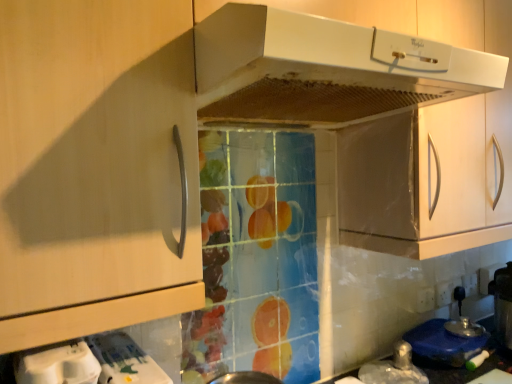
Question: Looking at the image, does white glossy water at lower left, placed as the second appliance when sorted from left to right, seem bigger or smaller compared to white matte range hood at upper center?

Choices:
 (A) small
 (B) big

Answer: (A)

Question: Looking at their shapes, would you say white glossy water at lower left, which is counted as the second appliance, starting from the back, is wider or thinner than white matte range hood at upper center?

Choices:
 (A) wide
 (B) thin

Answer: (B)

Question: Which is farther from the white matte range hood at upper center?

Choices:
 (A) blue plastic lid at lower right, marked as the third appliance in a left-to-right arrangement
 (B) white plastic container at lower left, the third appliance viewed from the right
 (C) white glossy water at lower left, placed as the second appliance when sorted from top to bottom

Answer: (A)

Question: Which object is positioned farthest from the blue plastic lid at lower right, marked as the third appliance in a left-to-right arrangement?

Choices:
 (A) white plastic container at lower left, marked as the third appliance in a back-to-front arrangement
 (B) white matte range hood at upper center
 (C) white glossy water at lower left, placed as the second appliance when sorted from top to bottom

Answer: (A)